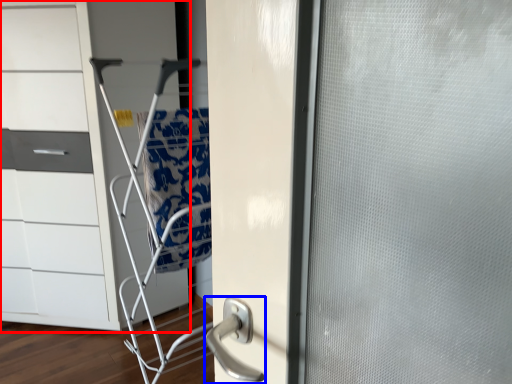
Question: Among these objects, which one is nearest to the camera, chest of drawers (highlighted by a red box) or door handle (highlighted by a blue box)?

Choices:
 (A) chest of drawers
 (B) door handle

Answer: (A)